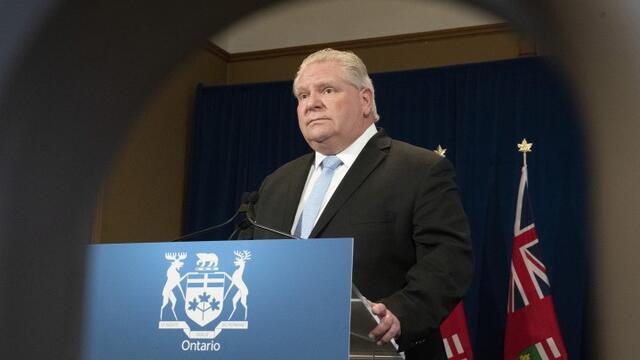
Where is `curtain`? Image resolution: width=640 pixels, height=360 pixels. curtain is located at coordinates (461, 156).